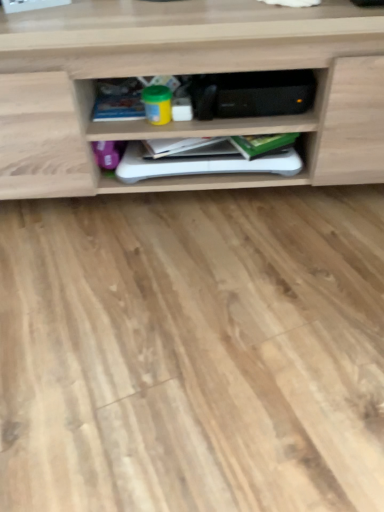
The height and width of the screenshot is (512, 384). In order to click on green matte book at center, the third book in the left-to-right sequence in this screenshot , I will do `click(262, 144)`.

In order to face wooden shelf at center, should I rotate leftwards or rightwards?

To align with it, rotate left about 0.490°.

Locate an element on the screen. green matte book at center, which appears as the first book when viewed from the right is located at coordinates (262, 144).

In terms of height, does white matte book at center, the 2th book in the right-to-left sequence, look taller or shorter compared to wooden shelf at center?

white matte book at center, the 2th book in the right-to-left sequence, is shorter than wooden shelf at center.

From a real-world perspective, between white matte book at center, placed as the second book when sorted from left to right, and wooden shelf at center, who is vertically higher?

From a 3D spatial view, wooden shelf at center is above.

Considering the relative sizes of white matte book at center, the 2th book in the right-to-left sequence, and wooden shelf at center in the image provided, is white matte book at center, the 2th book in the right-to-left sequence, smaller than wooden shelf at center?

Indeed, white matte book at center, the 2th book in the right-to-left sequence, has a smaller size compared to wooden shelf at center.

Which is more to the left, blue matte book at center, the 1th book viewed from the left, or white matte book at center, the 2th book in the right-to-left sequence?

blue matte book at center, the 1th book viewed from the left.

Is blue matte book at center, the 1th book viewed from the left, smaller than white matte book at center, placed as the second book when sorted from left to right?

Correct, blue matte book at center, the 1th book viewed from the left, occupies less space than white matte book at center, placed as the second book when sorted from left to right.

Is blue matte book at center, which appears as the third book when viewed from the right, in front of white matte book at center, the 2th book in the right-to-left sequence?

Yes, the depth of blue matte book at center, which appears as the third book when viewed from the right, is less than that of white matte book at center, the 2th book in the right-to-left sequence.

Is green matte book at center, the third book in the left-to-right sequence, positioned in front of wooden shelf at center?

No, green matte book at center, the third book in the left-to-right sequence, is further to the viewer.

Starting from the wooden shelf at center, which book is the 1st one behind? Please provide its 2D coordinates.

[(262, 144)]

From the image's perspective, is green matte book at center, which appears as the first book when viewed from the right, over wooden shelf at center?

No.

From a real-world perspective, is green matte book at center, the third book in the left-to-right sequence, over wooden shelf at center?

No, from a real-world perspective, green matte book at center, the third book in the left-to-right sequence, is not over wooden shelf at center

In the scene shown: Relative to white matte book at center, the 2th book in the right-to-left sequence, is green matte book at center, which appears as the first book when viewed from the right, in front or behind?

Clearly, green matte book at center, which appears as the first book when viewed from the right, is in front of white matte book at center, the 2th book in the right-to-left sequence.

From a real-world perspective, which object rests below the other?

white matte book at center, placed as the second book when sorted from left to right, is physically lower.

Considering the relative sizes of green matte book at center, which appears as the first book when viewed from the right, and white matte book at center, placed as the second book when sorted from left to right, in the image provided, is green matte book at center, which appears as the first book when viewed from the right, thinner than white matte book at center, placed as the second book when sorted from left to right,?

Indeed, green matte book at center, which appears as the first book when viewed from the right, has a lesser width compared to white matte book at center, placed as the second book when sorted from left to right.

Relative to blue matte book at center, which appears as the third book when viewed from the right, is wooden shelf at center in front or behind?

Visually, wooden shelf at center is located in front of blue matte book at center, which appears as the third book when viewed from the right.

Is point (13, 109) farther from viewer compared to point (121, 118)?

No.

How distant is wooden shelf at center from blue matte book at center, the 1th book viewed from the left?

10.07 inches.

Is wooden shelf at center oriented away from blue matte book at center, the 1th book viewed from the left?

Yes.

Is wooden shelf at center looking in the opposite direction of white matte book at center, the 2th book in the right-to-left sequence?

Yes, white matte book at center, the 2th book in the right-to-left sequence, is at the back of wooden shelf at center.

Which is further, (367, 109) or (233, 160)?

The point (233, 160) is more distant.

Can you confirm if wooden shelf at center is shorter than white matte book at center, the 2th book in the right-to-left sequence?

Incorrect, the height of wooden shelf at center does not fall short of that of white matte book at center, the 2th book in the right-to-left sequence.

From a real-world perspective, between wooden shelf at center and white matte book at center, the 2th book in the right-to-left sequence, who is vertically higher?

wooden shelf at center, from a real-world perspective.

Is blue matte book at center, the 1th book viewed from the left, thinner than green matte book at center, the third book in the left-to-right sequence?

No, blue matte book at center, the 1th book viewed from the left, is not thinner than green matte book at center, the third book in the left-to-right sequence.

From a real-world perspective, which object rests below the other?

green matte book at center, which appears as the first book when viewed from the right, is physically lower.

Is blue matte book at center, which appears as the third book when viewed from the right, not within green matte book at center, the third book in the left-to-right sequence?

Yes, blue matte book at center, which appears as the third book when viewed from the right, is located beyond the bounds of green matte book at center, the third book in the left-to-right sequence.

From the image's perspective, count 3rd books downward from the wooden shelf at center and point to it. Please provide its 2D coordinates.

[(204, 162)]

Locate an element on the screen. book that is the 2nd object located above the white matte book at center, the 2th book in the right-to-left sequence (from the image's perspective) is located at coordinates (118, 106).

Looking at this image, which object lies nearer to the anchor point wooden shelf at center, blue matte book at center, the 1th book viewed from the left, or white matte book at center, the 2th book in the right-to-left sequence?

white matte book at center, the 2th book in the right-to-left sequence, is closer to wooden shelf at center.

Which object lies nearer to the anchor point blue matte book at center, which appears as the third book when viewed from the right, wooden shelf at center or white matte book at center, placed as the second book when sorted from left to right?

white matte book at center, placed as the second book when sorted from left to right, is positioned closer to the anchor blue matte book at center, which appears as the third book when viewed from the right.

Estimate the real-world distances between objects in this image. Which object is closer to green matte book at center, the third book in the left-to-right sequence, white matte book at center, the 2th book in the right-to-left sequence, or blue matte book at center, the 1th book viewed from the left?

white matte book at center, the 2th book in the right-to-left sequence, is closer to green matte book at center, the third book in the left-to-right sequence.

From the image, which object appears to be nearer to blue matte book at center, which appears as the third book when viewed from the right, white matte book at center, placed as the second book when sorted from left to right, or green matte book at center, which appears as the first book when viewed from the right?

white matte book at center, placed as the second book when sorted from left to right.

Estimate the real-world distances between objects in this image. Which object is closer to blue matte book at center, the 1th book viewed from the left, green matte book at center, which appears as the first book when viewed from the right, or wooden shelf at center?

wooden shelf at center lies closer to blue matte book at center, the 1th book viewed from the left, than the other object.

Looking at the image, which one is located further to white matte book at center, placed as the second book when sorted from left to right, green matte book at center, the third book in the left-to-right sequence, or wooden shelf at center?

wooden shelf at center lies further to white matte book at center, placed as the second book when sorted from left to right, than the other object.

Looking at this image, based on their spatial positions, is white matte book at center, placed as the second book when sorted from left to right, or blue matte book at center, which appears as the third book when viewed from the right, further from wooden shelf at center?

The object further to wooden shelf at center is blue matte book at center, which appears as the third book when viewed from the right.

Based on their spatial positions, is wooden shelf at center or white matte book at center, placed as the second book when sorted from left to right, closer to green matte book at center, the third book in the left-to-right sequence?

Based on the image, white matte book at center, placed as the second book when sorted from left to right, appears to be nearer to green matte book at center, the third book in the left-to-right sequence.

Identify the location of book between blue matte book at center, the 1th book viewed from the left, and green matte book at center, the third book in the left-to-right sequence, from left to right. The width and height of the screenshot is (384, 512). (204, 162).

Locate an element on the screen. This screenshot has width=384, height=512. shelf between blue matte book at center, which appears as the third book when viewed from the right, and green matte book at center, which appears as the first book when viewed from the right, in the horizontal direction is located at coordinates (184, 73).